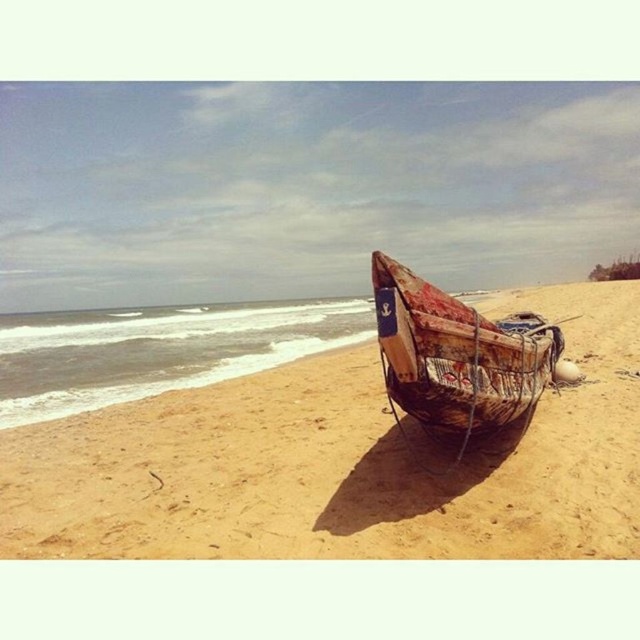
Does point (602, 346) come closer to viewer compared to point (406, 305)?

No.

Who is positioned more to the right, brown sandy beach at center or rusty wooden boat at center?

brown sandy beach at center is more to the right.

Where is `brown sandy beach at center`? This screenshot has height=640, width=640. brown sandy beach at center is located at coordinates (337, 465).